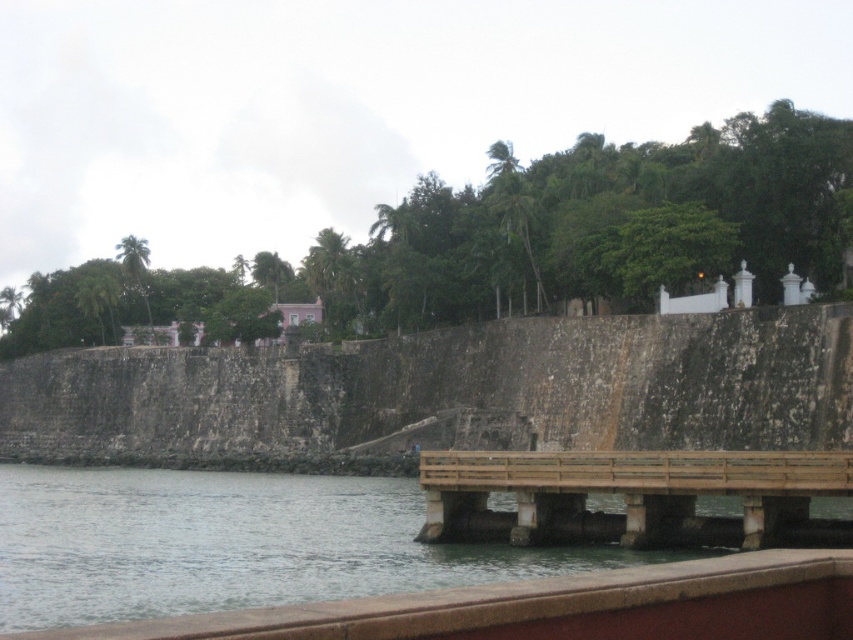
From the picture: Which is below, clear water at lower left or brown wooden dock at lower center?

clear water at lower left is lower down.

What do you see at coordinates (234, 544) in the screenshot? I see `clear water at lower left` at bounding box center [234, 544].

Where is `clear water at lower left`? This screenshot has height=640, width=853. clear water at lower left is located at coordinates (234, 544).